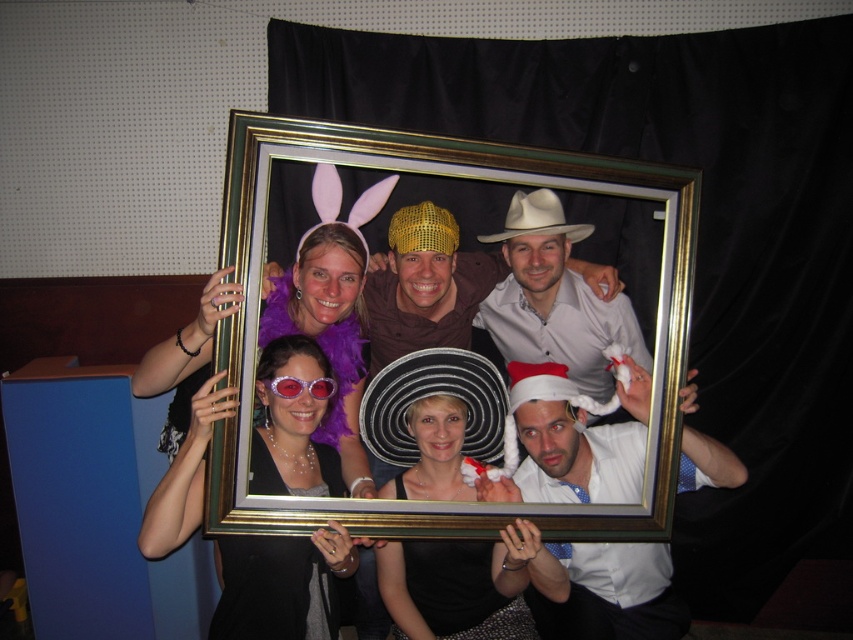
You are standing in front of the picture frame holding the group photo. There are two points marked on the frame at coordinates point (682, 246) and point (457, 371). Which point is closer to you?

Point (682, 246) is in front of point (457, 371), so it is closer to you.

You are a photographer trying to adjust the lighting for a group photo. You notice the matte purple dress at center and the gold sequined cowboy hat at center. Which object is taller in the scene?

The matte purple dress at center is taller than the gold sequined cowboy hat at center according to the description.

You are a photographer trying to adjust the focus on your camera. You need to focus on the matte purple dress at center and the gold sequined cowboy hat at center. Which one is lower in the frame?

The matte purple dress at center is below the gold sequined cowboy hat at center, so the matte purple dress at center is lower in the frame.